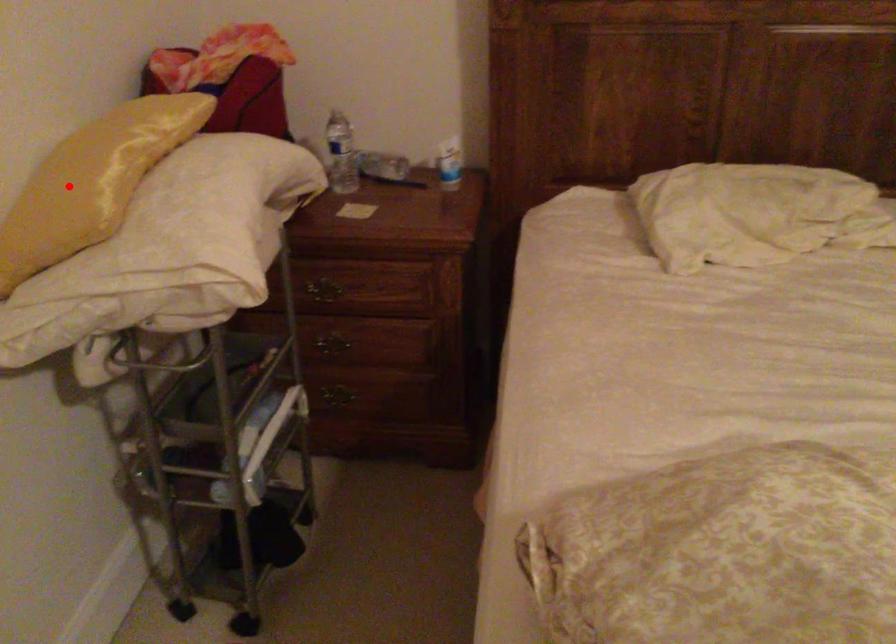
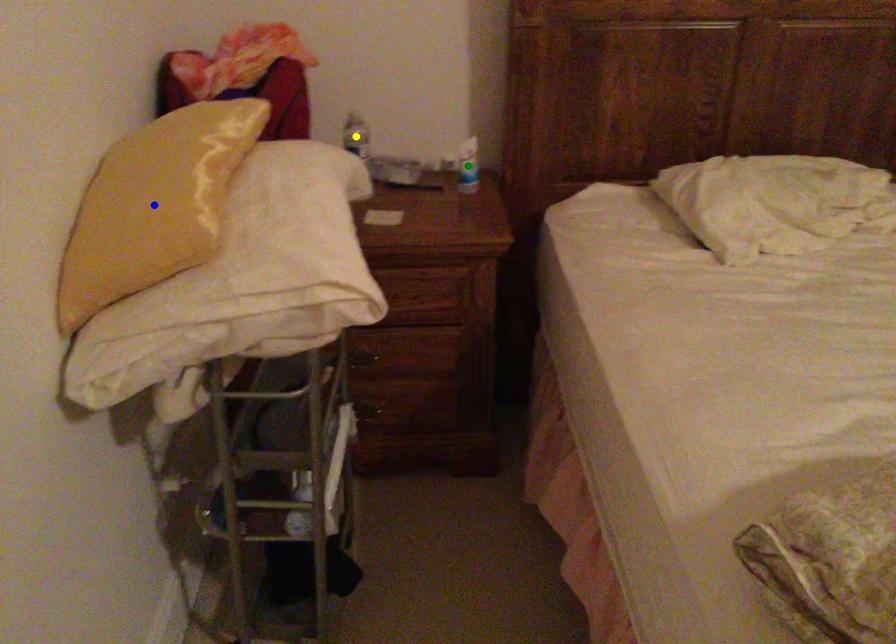
Question: I am providing you with two images of the same scene from different viewpoints. A red point is marked on the first image. You are given multiple points on the second image. Which mark in image 2 goes with the point in image 1?

Choices:
 (A) blue point
 (B) yellow point
 (C) green point

Answer: (A)